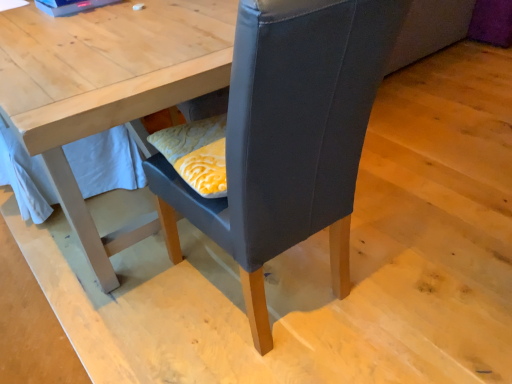
The width and height of the screenshot is (512, 384). Identify the location of vacant point to the right of matte black chair at center. (432, 270).